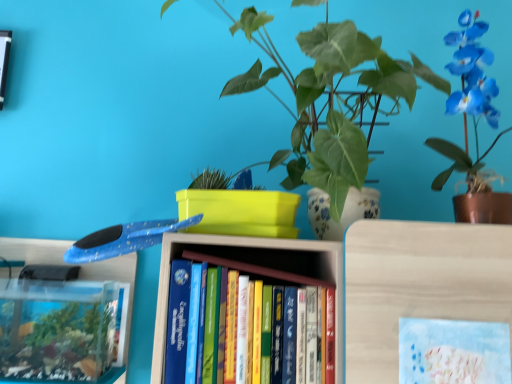
What do you see at coordinates (330, 100) in the screenshot?
I see `green glossy leafy plant at center, which is counted as the 2th houseplant, starting from the right` at bounding box center [330, 100].

Where is `blue glossy orchid at upper right, which is the first houseplant from right to left`? The height and width of the screenshot is (384, 512). blue glossy orchid at upper right, which is the first houseplant from right to left is located at coordinates (474, 126).

Where is `hardcover books at center`? hardcover books at center is located at coordinates (264, 261).

From the picture: Is the surface of green glossy leafy plant at center, marked as the 1th houseplant in a left-to-right arrangement, in direct contact with hardcover books at center?

No, green glossy leafy plant at center, marked as the 1th houseplant in a left-to-right arrangement, is not with hardcover books at center.

From a real-world perspective, is green glossy leafy plant at center, which is counted as the 2th houseplant, starting from the right, located higher than hardcover books at center?

Yes, from a real-world perspective, green glossy leafy plant at center, which is counted as the 2th houseplant, starting from the right, is on top of hardcover books at center.

How different are the orientations of green glossy leafy plant at center, which is counted as the 2th houseplant, starting from the right, and hardcover books at center in degrees?

They differ by 0.000248 degrees in their facing directions.

How many degrees apart are the facing directions of blue glossy orchid at upper right, arranged as the second houseplant when viewed from the left, and hardcover books at center?

There is a 0.000287-degree angle between the facing directions of blue glossy orchid at upper right, arranged as the second houseplant when viewed from the left, and hardcover books at center.

Is hardcover books at center completely or partially inside blue glossy orchid at upper right, arranged as the second houseplant when viewed from the left?

No, blue glossy orchid at upper right, arranged as the second houseplant when viewed from the left, does not contain hardcover books at center.

Locate an element on the screen. The height and width of the screenshot is (384, 512). the 1st houseplant above when counting from the hardcover books at center (from the image's perspective) is located at coordinates (474, 126).

Consider the image. Does blue glossy orchid at upper right, arranged as the second houseplant when viewed from the left, have a lesser width compared to hardcover books at center?

No, blue glossy orchid at upper right, arranged as the second houseplant when viewed from the left, is not thinner than hardcover books at center.

Considering the sizes of objects pastel blue paper at center and green glossy leafy plant at center, marked as the 1th houseplant in a left-to-right arrangement, in the image provided, who is shorter, pastel blue paper at center or green glossy leafy plant at center, marked as the 1th houseplant in a left-to-right arrangement,?

pastel blue paper at center.

Considering their positions, is pastel blue paper at center located in front of or behind green glossy leafy plant at center, marked as the 1th houseplant in a left-to-right arrangement?

In the image, pastel blue paper at center appears behind green glossy leafy plant at center, marked as the 1th houseplant in a left-to-right arrangement.

Is pastel blue paper at center not near green glossy leafy plant at center, which is counted as the 2th houseplant, starting from the right?

They are positioned close to each other.

Which of these two, pastel blue paper at center or green glossy leafy plant at center, which is counted as the 2th houseplant, starting from the right, is bigger?

Bigger between the two is green glossy leafy plant at center, which is counted as the 2th houseplant, starting from the right.

Is green glossy leafy plant at center, which is counted as the 2th houseplant, starting from the right, situated inside blue glossy orchid at upper right, arranged as the second houseplant when viewed from the left, or outside?

green glossy leafy plant at center, which is counted as the 2th houseplant, starting from the right, lies outside blue glossy orchid at upper right, arranged as the second houseplant when viewed from the left.

Is green glossy leafy plant at center, marked as the 1th houseplant in a left-to-right arrangement, in contact with blue glossy orchid at upper right, which is the first houseplant from right to left?

green glossy leafy plant at center, marked as the 1th houseplant in a left-to-right arrangement, and blue glossy orchid at upper right, which is the first houseplant from right to left, are not in contact.

Is green glossy leafy plant at center, marked as the 1th houseplant in a left-to-right arrangement, closer to camera compared to blue glossy orchid at upper right, arranged as the second houseplant when viewed from the left?

Yes.

Locate an element on the screen. Image resolution: width=512 pixels, height=384 pixels. houseplant below the green glossy leafy plant at center, marked as the 1th houseplant in a left-to-right arrangement (from the image's perspective) is located at coordinates (474, 126).

Who is smaller, blue glossy orchid at upper right, arranged as the second houseplant when viewed from the left, or green glossy leafy plant at center, which is counted as the 2th houseplant, starting from the right?

blue glossy orchid at upper right, arranged as the second houseplant when viewed from the left.

Does blue glossy orchid at upper right, which is the first houseplant from right to left, lie behind green glossy leafy plant at center, marked as the 1th houseplant in a left-to-right arrangement?

Yes, blue glossy orchid at upper right, which is the first houseplant from right to left, is behind green glossy leafy plant at center, marked as the 1th houseplant in a left-to-right arrangement.

Considering the points (474, 221) and (302, 154), which point is behind, point (474, 221) or point (302, 154)?

Positioned behind is point (302, 154).

Based on the photo, considering the relative sizes of hardcover books at center and pastel blue paper at center in the image provided, is hardcover books at center taller than pastel blue paper at center?

No.

Looking at this image, from a real-world perspective, does hardcover books at center sit lower than pastel blue paper at center?

No.

How different are the orientations of hardcover books at center and pastel blue paper at center in degrees?

The angular difference between hardcover books at center and pastel blue paper at center is 0.0116 degrees.

Is hardcover books at center next to pastel blue paper at center and touching it?

They are not placed beside each other.

Could you measure the distance between hardcover books at center and green glossy leafy plant at center, which is counted as the 2th houseplant, starting from the right?

They are 11.93 inches apart.

Can you confirm if hardcover books at center is positioned to the right of green glossy leafy plant at center, which is counted as the 2th houseplant, starting from the right?

A: In fact, hardcover books at center is to the left of green glossy leafy plant at center, which is counted as the 2th houseplant, starting from the right.

What's the angular difference between hardcover books at center and green glossy leafy plant at center, which is counted as the 2th houseplant, starting from the right,'s facing directions?

hardcover books at center and green glossy leafy plant at center, which is counted as the 2th houseplant, starting from the right, are facing 0.000248 degrees away from each other.

From their relative heights in the image, would you say hardcover books at center is taller or shorter than green glossy leafy plant at center, marked as the 1th houseplant in a left-to-right arrangement?

Considering their sizes, hardcover books at center has less height than green glossy leafy plant at center, marked as the 1th houseplant in a left-to-right arrangement.

This screenshot has height=384, width=512. In the image, there is a green glossy leafy plant at center, which is counted as the 2th houseplant, starting from the right. What are the coordinates of `book below it (from the image's perspective)` in the screenshot? It's located at (264, 261).

Where is `book that appears below the blue glossy orchid at upper right, which is the first houseplant from right to left (from a real-world perspective)`? book that appears below the blue glossy orchid at upper right, which is the first houseplant from right to left (from a real-world perspective) is located at coordinates (264, 261).

Based on their spatial positions, is hardcover books at center or pastel blue paper at center closer to blue glossy orchid at upper right, which is the first houseplant from right to left?

Among the two, pastel blue paper at center is located nearer to blue glossy orchid at upper right, which is the first houseplant from right to left.

Considering their positions, is pastel blue paper at center positioned closer to hardcover books at center than blue glossy orchid at upper right, which is the first houseplant from right to left?

pastel blue paper at center is closer to hardcover books at center.

Which object lies nearer to the anchor point hardcover books at center, green glossy leafy plant at center, marked as the 1th houseplant in a left-to-right arrangement, or pastel blue paper at center?

pastel blue paper at center.

Estimate the real-world distances between objects in this image. Which object is further from blue glossy orchid at upper right, which is the first houseplant from right to left, green glossy leafy plant at center, which is counted as the 2th houseplant, starting from the right, or pastel blue paper at center?

Among the two, pastel blue paper at center is located further to blue glossy orchid at upper right, which is the first houseplant from right to left.

When comparing their distances from green glossy leafy plant at center, marked as the 1th houseplant in a left-to-right arrangement, does blue glossy orchid at upper right, arranged as the second houseplant when viewed from the left, or hardcover books at center seem further?

hardcover books at center lies further to green glossy leafy plant at center, marked as the 1th houseplant in a left-to-right arrangement, than the other object.

From the image, which object appears to be nearer to green glossy leafy plant at center, marked as the 1th houseplant in a left-to-right arrangement, pastel blue paper at center or blue glossy orchid at upper right, arranged as the second houseplant when viewed from the left?

blue glossy orchid at upper right, arranged as the second houseplant when viewed from the left, is positioned closer to the anchor green glossy leafy plant at center, marked as the 1th houseplant in a left-to-right arrangement.

From the image, which object appears to be nearer to pastel blue paper at center, hardcover books at center or green glossy leafy plant at center, marked as the 1th houseplant in a left-to-right arrangement?

The object closer to pastel blue paper at center is hardcover books at center.

From the image, which object appears to be farther from hardcover books at center, pastel blue paper at center or green glossy leafy plant at center, marked as the 1th houseplant in a left-to-right arrangement?

Based on the image, green glossy leafy plant at center, marked as the 1th houseplant in a left-to-right arrangement, appears to be further to hardcover books at center.

The height and width of the screenshot is (384, 512). I want to click on book between green glossy leafy plant at center, marked as the 1th houseplant in a left-to-right arrangement, and pastel blue paper at center, in the vertical direction, so click(x=264, y=261).

Where is `book between blue glossy orchid at upper right, which is the first houseplant from right to left, and pastel blue paper at center in the up-down direction`? The image size is (512, 384). book between blue glossy orchid at upper right, which is the first houseplant from right to left, and pastel blue paper at center in the up-down direction is located at coordinates (264, 261).

This screenshot has width=512, height=384. In order to click on houseplant between green glossy leafy plant at center, marked as the 1th houseplant in a left-to-right arrangement, and pastel blue paper at center vertically in this screenshot , I will do `click(474, 126)`.

Find the location of a particular element. Image resolution: width=512 pixels, height=384 pixels. houseplant that lies between green glossy leafy plant at center, which is counted as the 2th houseplant, starting from the right, and hardcover books at center from top to bottom is located at coordinates (474, 126).